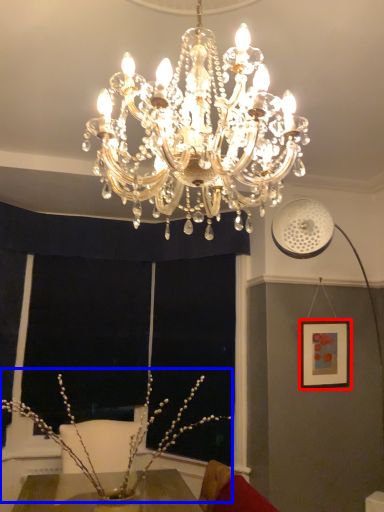
Question: Which of the following is the farthest to the observer, picture frame (highlighted by a red box) or floral arrangement (highlighted by a blue box)?

Choices:
 (A) picture frame
 (B) floral arrangement

Answer: (A)